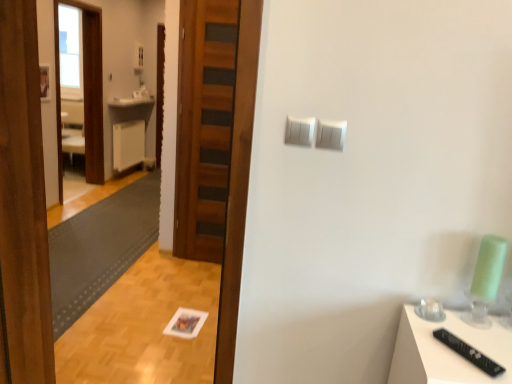
Question: Is wooden screen door at left to the left or to the right of white plastic light switch at upper center, which is the 1th light switch in right-to-left order, in the image?

Choices:
 (A) left
 (B) right

Answer: (A)

Question: Does point (95, 59) appear closer or farther from the camera than point (330, 139)?

Choices:
 (A) closer
 (B) farther

Answer: (B)

Question: Which is nearer to the white plastic light switch at upper center, which is the 1th light switch in right-to-left order?

Choices:
 (A) white matte radiator at center
 (B) dark gray textured mat at lower left
 (C) white glossy counter top at center
 (D) white plastic light switch at upper center, positioned as the 1th light switch in left-to-right order
 (E) wooden door at center

Answer: (D)

Question: Estimate the real-world distances between objects in this image. Which object is closer to the white plastic light switch at upper center, the second light switch positioned from the left?

Choices:
 (A) white glossy counter top at center
 (B) wooden door at center
 (C) wooden screen door at left
 (D) white plastic light switch at upper center, which is the 2th light switch in right-to-left order
 (E) white matte radiator at center

Answer: (D)